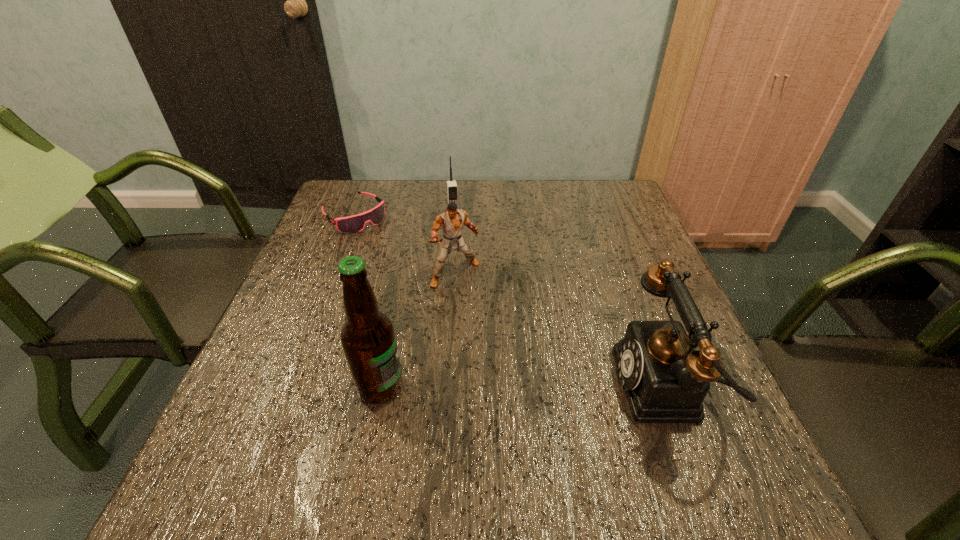
At what (x,y) coordinates should I click in order to perform the action: click on free space located 0.260m on the front of the rightmost object at the rotary dial. Please return your answer as a coordinate pair (x, y). The width and height of the screenshot is (960, 540). Looking at the image, I should click on (479, 387).

At what (x,y) coordinates should I click in order to perform the action: click on blank space located on the front-facing side of the puncher. Please return your answer as a coordinate pair (x, y). Image resolution: width=960 pixels, height=540 pixels. Looking at the image, I should click on (519, 360).

Locate an element on the screen. The height and width of the screenshot is (540, 960). free location located 0.340m on the front-facing side of the puncher is located at coordinates (548, 398).

Image resolution: width=960 pixels, height=540 pixels. I want to click on free space located on the front-facing side of the puncher, so click(505, 339).

At what (x,y) coordinates should I click in order to perform the action: click on vacant space located 0.260m on the front-facing side of the leftmost object. Please return your answer as a coordinate pair (x, y). The image size is (960, 540). Looking at the image, I should click on (422, 278).

You are a GUI agent. You are given a task and a screenshot of the screen. Output one action in this format:
    pyautogui.click(x=<x>, y=<y>)
    Task: Click on the vacant region located 0.270m on the front-facing side of the leftmost object
    
    Given the screenshot: What is the action you would take?
    pyautogui.click(x=424, y=280)

Locate an element on the screen. The width and height of the screenshot is (960, 540). free space located 0.130m on the front-facing side of the leftmost object is located at coordinates pos(395,252).

The image size is (960, 540). Find the location of `vacant region located on the front-facing side of the cellular telephone`. vacant region located on the front-facing side of the cellular telephone is located at coordinates (468, 289).

Where is `vacant point located 0.170m on the front-facing side of the cellular telephone`? This screenshot has width=960, height=540. vacant point located 0.170m on the front-facing side of the cellular telephone is located at coordinates (462, 258).

Identify the location of free point located on the front-facing side of the cellular telephone. (475, 320).